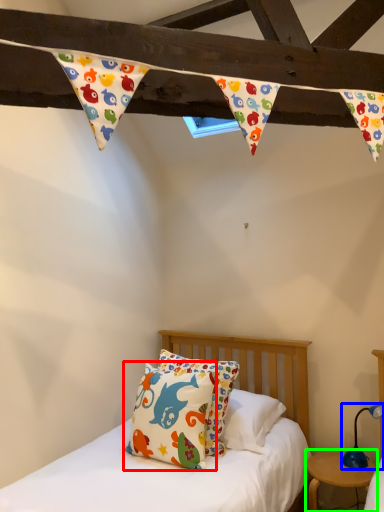
Question: Which object is positioned farthest from pillow (highlighted by a red box)? Select from table lamp (highlighted by a blue box) and nightstand (highlighted by a green box).

Choices:
 (A) table lamp
 (B) nightstand

Answer: (A)